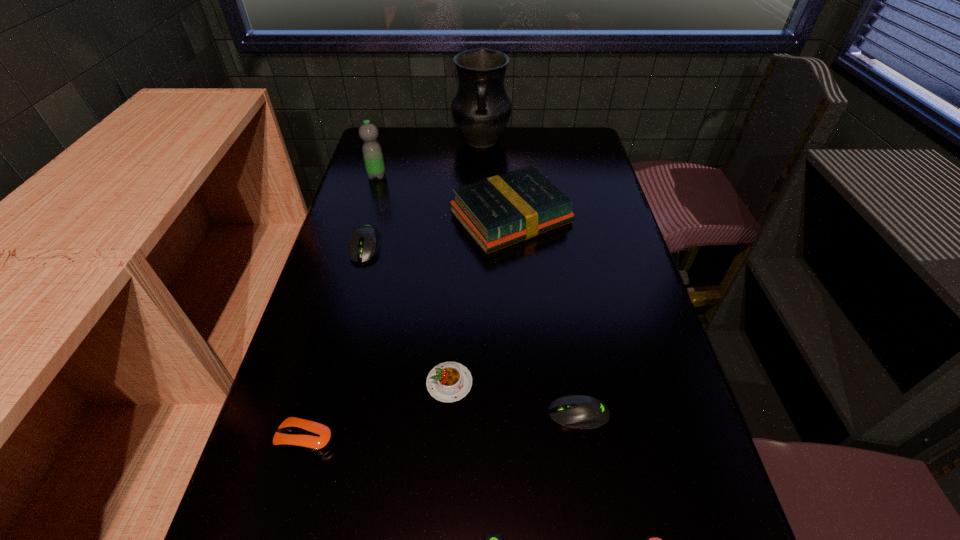
I want to click on pudding, so click(x=448, y=382).

You are a GUI agent. You are given a task and a screenshot of the screen. Output one action in this format:
    pyautogui.click(x=<x>, y=<y>)
    Task: Click on the farther orange computer mouse
    
    Given the screenshot: What is the action you would take?
    pyautogui.click(x=312, y=438)

At what (x,y) coordinates should I click in order to perform the action: click on the left orange computer mouse. Please return your answer as a coordinate pair (x, y). Looking at the image, I should click on (312, 438).

I want to click on vacant space located on the handle side of the pitcher, so click(482, 184).

Find the location of a particular element. The height and width of the screenshot is (540, 960). blank area located 0.340m on the front of the green water bottle is located at coordinates (355, 252).

Find the location of a particular element. free region located 0.390m on the front of the yellow hardback book is located at coordinates (523, 384).

The width and height of the screenshot is (960, 540). Find the location of `vacant area situated on the wheel side of the leftmost gray computer mouse`. vacant area situated on the wheel side of the leftmost gray computer mouse is located at coordinates (338, 350).

I want to click on vacant area situated on the wheel side of the rightmost gray computer mouse, so click(348, 414).

This screenshot has height=540, width=960. In order to click on vacant space located on the wheel side of the rightmost gray computer mouse in this screenshot , I will do (x=443, y=414).

Identify the location of vacant space located 0.210m on the wheel side of the rightmost gray computer mouse. (443, 414).